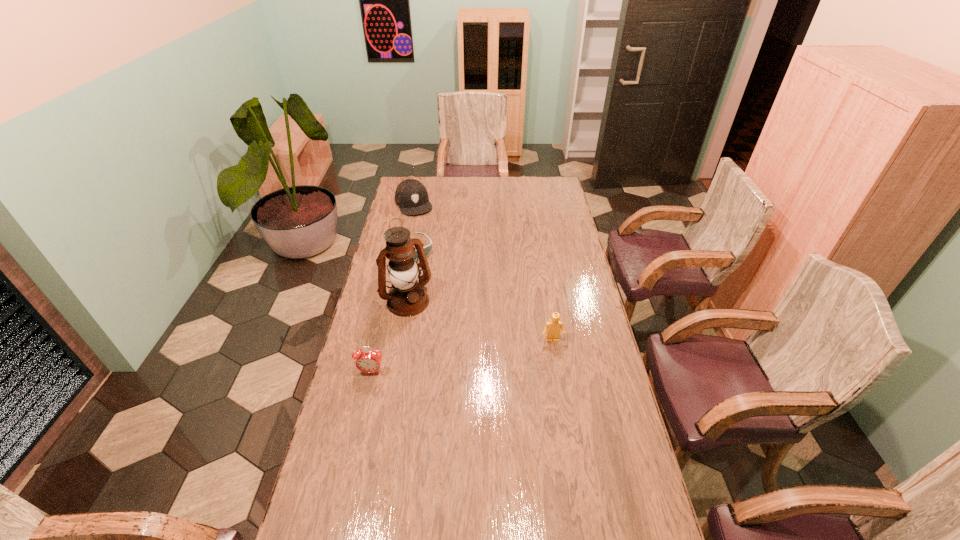
At what (x,y) coordinates should I click in order to perform the action: click on vacant space on the desktop that is between the nearest object and the fourth farthest object and is positioned on the side of the third farthest object, there is a wick adjustment knob. Please return your answer as a coordinate pair (x, y). This screenshot has width=960, height=540. Looking at the image, I should click on (446, 359).

This screenshot has width=960, height=540. I want to click on free spot on the desktop that is between the alarm clock and the Lego and is positioned on the front-facing side of the fourth nearest object, so click(484, 352).

This screenshot has width=960, height=540. What are the coordinates of `vacant spot on the desktop that is between the alarm clock and the rightmost object and is positioned on the front-facing side of the farthest object` in the screenshot? It's located at (485, 352).